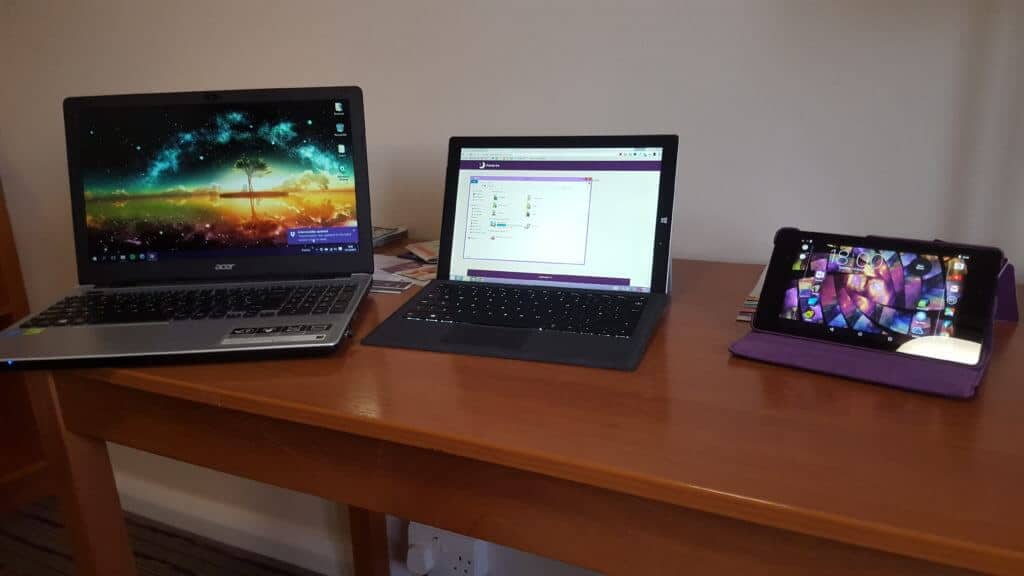
Locate an element on the screen. shadow on wall is located at coordinates (963, 105).